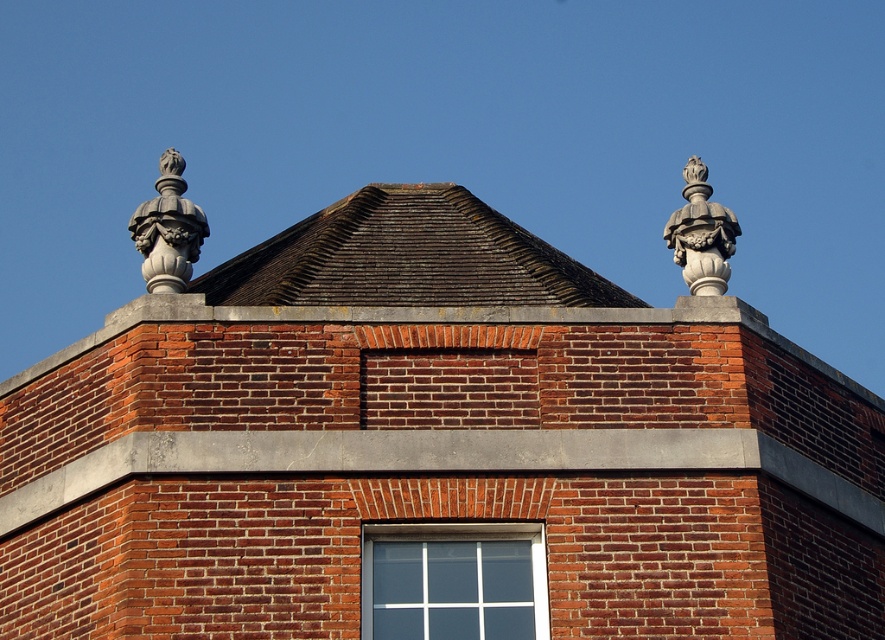
Question: Does brown shingles at center have a greater width compared to gray stone finial at upper left?

Choices:
 (A) yes
 (B) no

Answer: (B)

Question: Observing the image, what is the correct spatial positioning of brown shingles at center in reference to gray stone finial at upper left?

Choices:
 (A) right
 (B) left

Answer: (A)

Question: Among these objects, which one is nearest to the camera?

Choices:
 (A) white glass window at center
 (B) gray stone finial at upper left

Answer: (A)

Question: Which point is farther to the camera?

Choices:
 (A) white glass window at center
 (B) brown shingles at center

Answer: (B)

Question: Considering the relative positions of brown shingles at center and gray stone finial at upper left in the image provided, where is brown shingles at center located with respect to gray stone finial at upper left?

Choices:
 (A) left
 (B) right

Answer: (B)

Question: Which is nearer to the brown shingles at center?

Choices:
 (A) gray stone finial at upper left
 (B) white glass window at center
 (C) white stone ornament at upper right

Answer: (B)